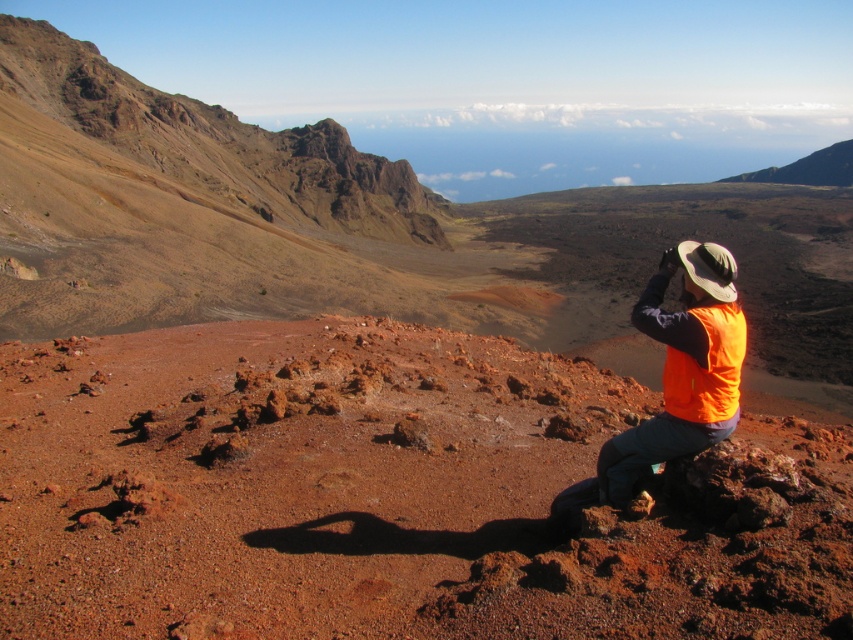
You are standing at the point marked by the coordinates point [389,493] in the volcanic landscape. What color is the ground beneath your feet?

The ground beneath your feet at point [389,493] is dull reddish brown.